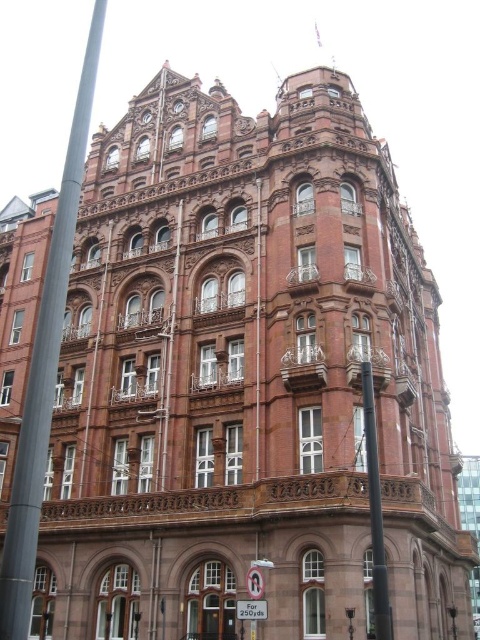
You are standing in front of the grand building and want to walk from the metallic pole at left to the smooth black pole at center. Which direction should you move relative to the building?

You should move to the right relative to the building to go from the metallic pole at left to the smooth black pole at center since the metallic pole at left is positioned to the left of the smooth black pole at center.